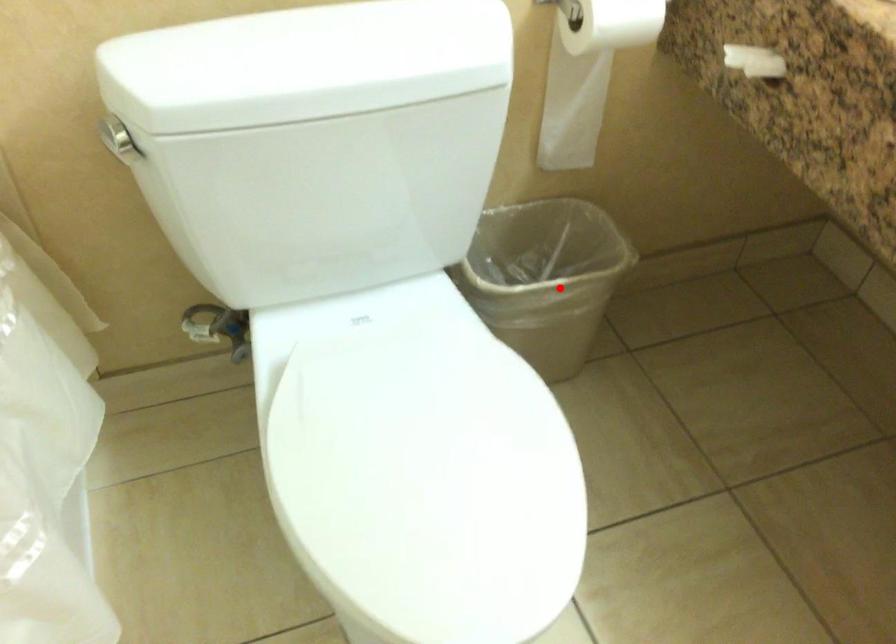
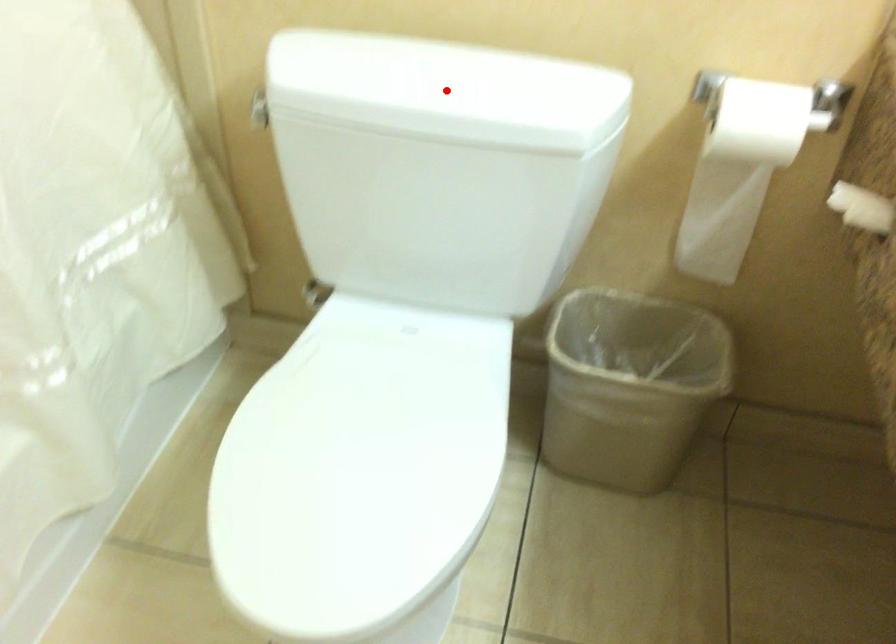
I am providing you with two images of the same scene from different viewpoints. A red point is marked on the first image and another point is marked on the second image. Is the red point in image1 aligned with the point shown in image2?

No